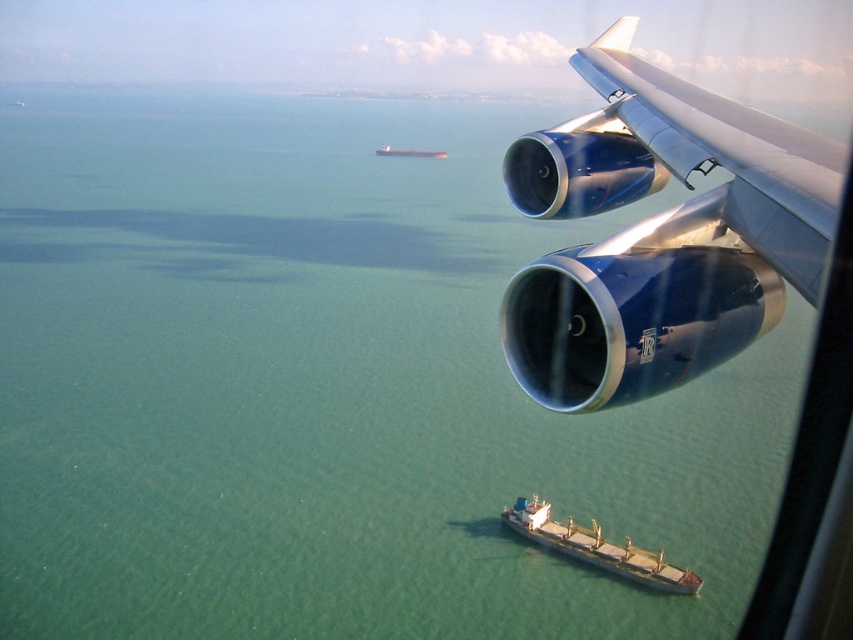
This screenshot has width=853, height=640. Find the location of `metallic gray ship at lower center`. metallic gray ship at lower center is located at coordinates (596, 548).

Between metallic gray ship at lower center and metallic gray ship at center, which one has less height?

With less height is metallic gray ship at lower center.

Find the location of a particular element. metallic gray ship at lower center is located at coordinates (596, 548).

Which of these two, blue metallic engine at upper right or metallic gray ship at center, stands shorter?

Standing shorter between the two is blue metallic engine at upper right.

This screenshot has height=640, width=853. What do you see at coordinates (660, 234) in the screenshot? I see `blue metallic engine at upper right` at bounding box center [660, 234].

The width and height of the screenshot is (853, 640). I want to click on blue metallic engine at upper right, so click(660, 234).

Can you confirm if blue metallic engine at upper right is positioned to the left of metallic gray ship at lower center?

Indeed, blue metallic engine at upper right is positioned on the left side of metallic gray ship at lower center.

In the scene shown: Is blue metallic engine at upper right thinner than metallic gray ship at lower center?

Yes, blue metallic engine at upper right is thinner than metallic gray ship at lower center.

At what (x,y) coordinates should I click in order to perform the action: click on blue metallic engine at upper right. Please return your answer as a coordinate pair (x, y). The width and height of the screenshot is (853, 640). Looking at the image, I should click on (660, 234).

Locate an element on the screen. This screenshot has width=853, height=640. blue metallic engine at upper right is located at coordinates (660, 234).